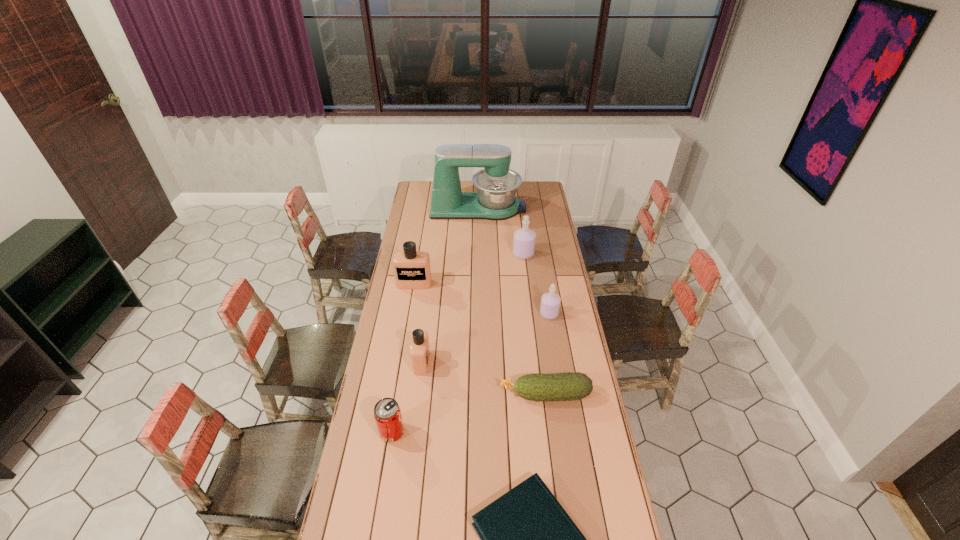
Where is `empty space that is in between the farthest object and the smaller purple perfume`? empty space that is in between the farthest object and the smaller purple perfume is located at coordinates (514, 261).

This screenshot has width=960, height=540. What are the coordinates of `vacant area that lies between the nearest perfume and the tallest object` in the screenshot? It's located at (450, 285).

Find the location of a particular element. empty space that is in between the second farthest perfume and the red pop soda is located at coordinates (403, 357).

Choose which object is the second nearest neighbor to the farther beige perfume. Please provide its 2D coordinates. Your answer should be formatted as a tuple, i.e. [(x, y)], where the tuple contains the x and y coordinates of a point satisfying the conditions above.

[(524, 239)]

Identify which object is the fourth nearest to the blue book. Please provide its 2D coordinates. Your answer should be formatted as a tuple, i.e. [(x, y)], where the tuple contains the x and y coordinates of a point satisfying the conditions above.

[(550, 302)]

At what (x,y) coordinates should I click in order to perform the action: click on perfume that is the closest to the second nearest object. Please return your answer as a coordinate pair (x, y). The height and width of the screenshot is (540, 960). Looking at the image, I should click on (419, 350).

I want to click on perfume that is the fourth nearest to the second shortest object, so click(524, 239).

Where is `free space that satisfies the following two spatial constraints: 1. on the front-facing side of the tallest object; 2. on the left side of the third farthest perfume`? The height and width of the screenshot is (540, 960). free space that satisfies the following two spatial constraints: 1. on the front-facing side of the tallest object; 2. on the left side of the third farthest perfume is located at coordinates (478, 314).

Locate an element on the screen. This screenshot has height=540, width=960. free spot that satisfies the following two spatial constraints: 1. on the front label of the sixth tallest object; 2. on the left side of the farther beige perfume is located at coordinates (389, 432).